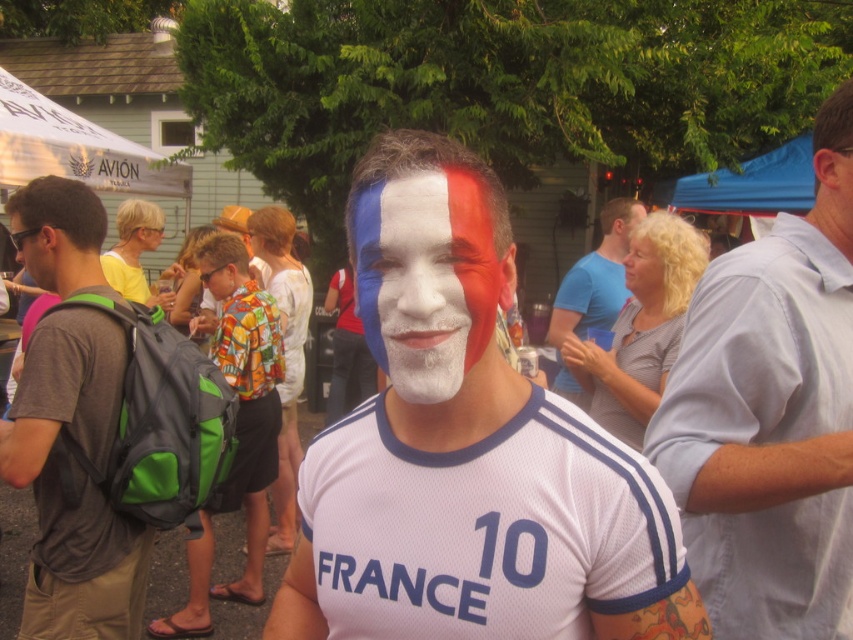
Question: Which object appears farthest from the camera in this image?

Choices:
 (A) matte white face at center
 (B) gray fabric backpack at left
 (C) matte white face paint at center

Answer: (A)

Question: Which of the following is the closest to the observer?

Choices:
 (A) smooth blonde hair at upper right
 (B) matte white face at center
 (C) light blue shirt at center
 (D) matte white face paint at center

Answer: (D)

Question: Can you confirm if gray fabric backpack at left is thinner than white matte face paint at center?

Choices:
 (A) no
 (B) yes

Answer: (A)

Question: Is matte paint face at center thinner than smooth blonde hair at upper right?

Choices:
 (A) no
 (B) yes

Answer: (A)

Question: Among these objects, which one is farthest from the camera?

Choices:
 (A) white matte face paint at center
 (B) smooth blonde hair at upper right
 (C) matte white face paint at center
 (D) gray fabric backpack at left

Answer: (A)

Question: Is light blue shirt at center to the right of matte paint face at center from the viewer's perspective?

Choices:
 (A) no
 (B) yes

Answer: (B)